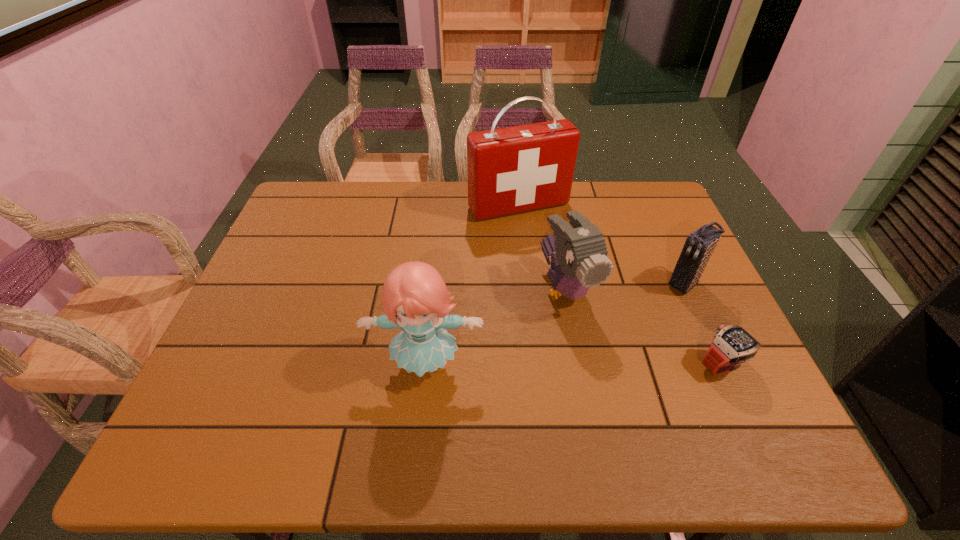
This screenshot has height=540, width=960. I want to click on vacant space that satisfies the following two spatial constraints: 1. on the front side of the bird; 2. on the left side of the tallest object, so click(527, 289).

Find the location of a particular element. The height and width of the screenshot is (540, 960). vacant space that satisfies the following two spatial constraints: 1. on the front side of the clutch bag; 2. on the right side of the first-aid kit is located at coordinates (527, 285).

Locate an element on the screen. The height and width of the screenshot is (540, 960). free space that satisfies the following two spatial constraints: 1. on the back side of the clutch bag; 2. on the right side of the bird is located at coordinates (566, 285).